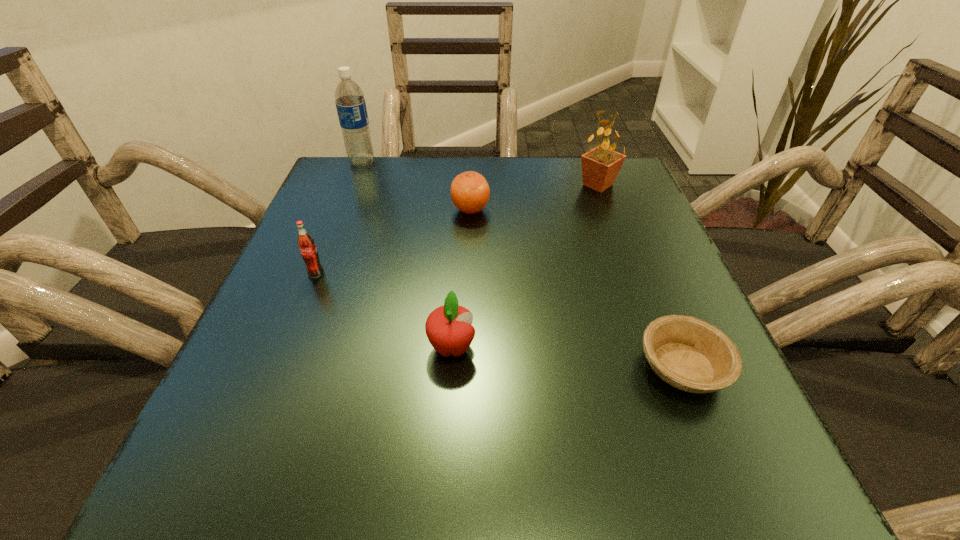
Find the location of `free space located at the front of the sunflower with flowers visible`. free space located at the front of the sunflower with flowers visible is located at coordinates (524, 185).

Identify the location of free space located 0.180m at the front of the sunflower with flowers visible. (498, 185).

Find the location of a particular element. This screenshot has height=540, width=960. vacant region located 0.290m at the front of the sunflower with flowers visible is located at coordinates (451, 185).

I want to click on free region located on the label of the third tallest object, so click(285, 350).

In order to click on free space located 0.190m on the front of the apple in this screenshot , I will do `click(443, 504)`.

Locate an element on the screen. The height and width of the screenshot is (540, 960). free space located on the right of the orange is located at coordinates (537, 210).

Identify the location of free space located 0.300m on the left of the shortest object. (434, 367).

This screenshot has height=540, width=960. Find the location of `water bottle present at the far edge`. water bottle present at the far edge is located at coordinates (351, 107).

Image resolution: width=960 pixels, height=540 pixels. I want to click on sunflower located at the far edge, so click(x=600, y=166).

At what (x,y) coordinates should I click in order to perform the action: click on orange that is at the far edge. Please return your answer as a coordinate pair (x, y). Image resolution: width=960 pixels, height=540 pixels. Looking at the image, I should click on (470, 191).